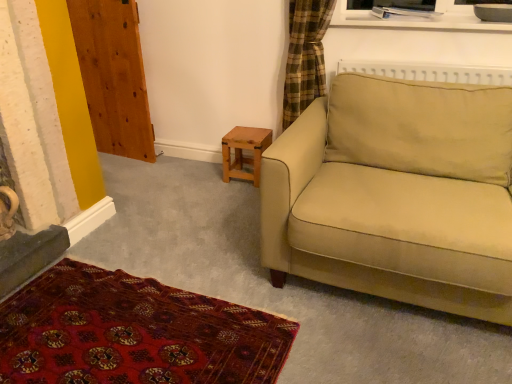
Where is `vacant space that is in between beige fabric couch at right and wooden at left`? This screenshot has height=384, width=512. vacant space that is in between beige fabric couch at right and wooden at left is located at coordinates (190, 199).